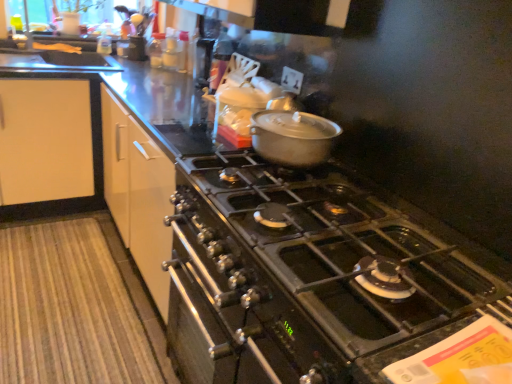
Question: Considering the relative sizes of yellow matte bread at upper left and matte silver pot at center in the image provided, is yellow matte bread at upper left shorter than matte silver pot at center?

Choices:
 (A) no
 (B) yes

Answer: (B)

Question: Does yellow matte bread at upper left have a larger size compared to matte silver pot at center?

Choices:
 (A) no
 (B) yes

Answer: (A)

Question: Would you say yellow matte bread at upper left contains matte silver pot at center?

Choices:
 (A) yes
 (B) no

Answer: (B)

Question: Is yellow matte bread at upper left further to the viewer compared to matte silver pot at center?

Choices:
 (A) no
 (B) yes

Answer: (B)

Question: Considering the relative sizes of yellow matte bread at upper left and matte silver pot at center in the image provided, is yellow matte bread at upper left thinner than matte silver pot at center?

Choices:
 (A) no
 (B) yes

Answer: (B)

Question: Is matte silver pot at center in front of or behind yellow matte bread at upper left in the image?

Choices:
 (A) behind
 (B) front

Answer: (B)

Question: From a real-world perspective, is matte silver pot at center positioned above or below yellow matte bread at upper left?

Choices:
 (A) below
 (B) above

Answer: (B)

Question: Do you think matte silver pot at center is within yellow matte bread at upper left, or outside of it?

Choices:
 (A) outside
 (B) inside

Answer: (A)

Question: Looking at the image, does matte silver pot at center seem bigger or smaller compared to yellow matte bread at upper left?

Choices:
 (A) small
 (B) big

Answer: (B)

Question: Is black stainless steel oven at center taller or shorter than matte silver pot at center?

Choices:
 (A) tall
 (B) short

Answer: (A)

Question: Considering the positions of black stainless steel oven at center and matte silver pot at center in the image, is black stainless steel oven at center bigger or smaller than matte silver pot at center?

Choices:
 (A) big
 (B) small

Answer: (A)

Question: From a real-world perspective, is black stainless steel oven at center physically located above or below matte silver pot at center?

Choices:
 (A) below
 (B) above

Answer: (A)

Question: Is point [x=275, y=296] positioned closer to the camera than point [x=265, y=150]?

Choices:
 (A) closer
 (B) farther

Answer: (A)

Question: From the image's perspective, is black stainless steel oven at center above or below yellow matte bread at upper left?

Choices:
 (A) above
 (B) below

Answer: (B)

Question: Based on their sizes in the image, would you say black stainless steel oven at center is bigger or smaller than yellow matte bread at upper left?

Choices:
 (A) big
 (B) small

Answer: (A)